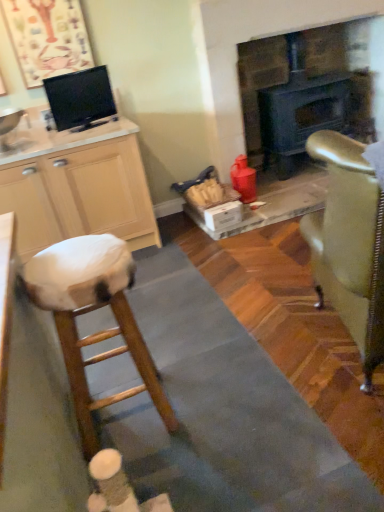
Locate an element on the screen. The image size is (384, 512). vacant region in front of black glossy tv at upper left is located at coordinates (87, 136).